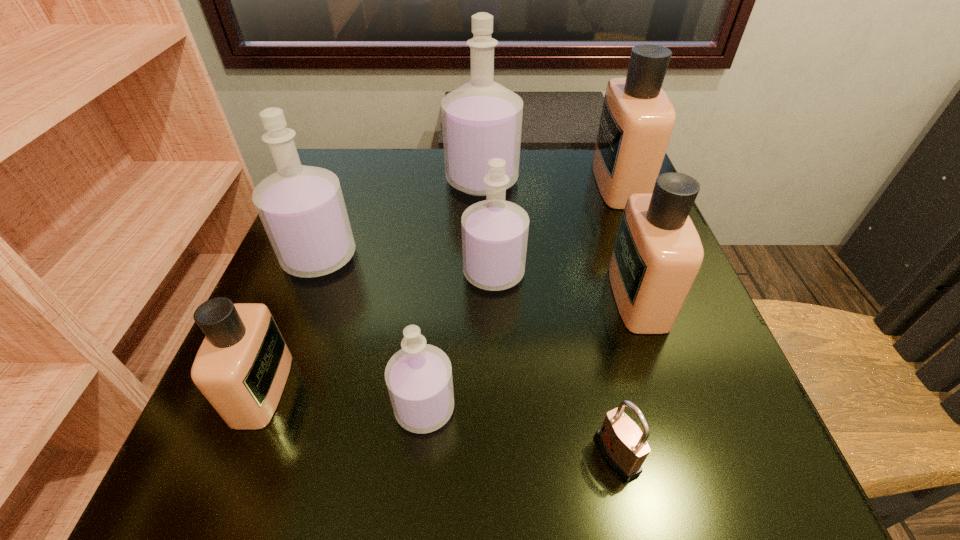
You are a GUI agent. You are given a task and a screenshot of the screen. Output one action in this format:
    pyautogui.click(x=<x>, y=<y>)
    Task: Click on the biggest purple perfume
    This screenshot has width=960, height=540.
    Given the screenshot: What is the action you would take?
    pyautogui.click(x=481, y=120)

Locate an element on the screen. The height and width of the screenshot is (540, 960). the tallest perfume is located at coordinates (481, 120).

The height and width of the screenshot is (540, 960). In order to click on the farthest beige perfume in this screenshot , I will do `click(637, 119)`.

This screenshot has width=960, height=540. Identify the location of the leftmost purple perfume. (302, 209).

Identify the location of the third biggest purple perfume. (494, 232).

The width and height of the screenshot is (960, 540). I want to click on the second biggest beige perfume, so click(x=657, y=254).

Identify the location of the smallest purple perfume. (419, 380).

Image resolution: width=960 pixels, height=540 pixels. In order to click on the smallest beige perfume in this screenshot , I will do `click(242, 365)`.

You are a GUI agent. You are given a task and a screenshot of the screen. Output one action in this format:
    pyautogui.click(x=<x>, y=<y>)
    Task: Click on the leftmost beige perfume
    
    Given the screenshot: What is the action you would take?
    pyautogui.click(x=242, y=365)

You are a GUI agent. You are given a task and a screenshot of the screen. Output one action in this format:
    pyautogui.click(x=<x>, y=<y>)
    Task: Click on the shortest object
    The height and width of the screenshot is (540, 960).
    Given the screenshot: What is the action you would take?
    pyautogui.click(x=624, y=446)